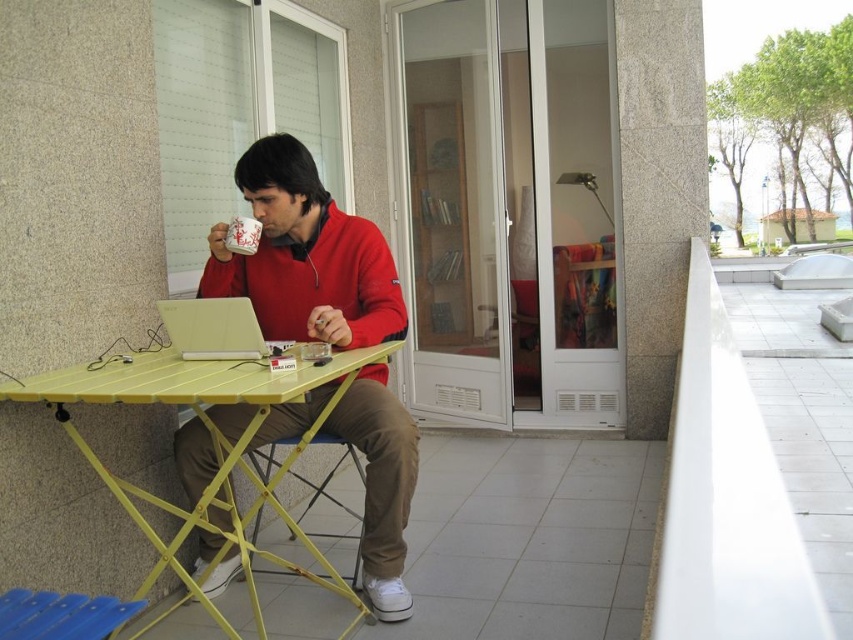
Is yellow plastic table at center bigger than white plastic laptop at center?

Yes.

Between yellow plastic table at center and white plastic laptop at center, which one is positioned higher?

white plastic laptop at center is above.

Find the location of a particular element. yellow plastic table at center is located at coordinates (213, 444).

I want to click on yellow plastic table at center, so click(213, 444).

Which is above, matte red sweater at center or white plastic laptop at center?

white plastic laptop at center

Which is more to the left, matte red sweater at center or white plastic laptop at center?

white plastic laptop at center is more to the left.

Where is `matte red sweater at center`? Image resolution: width=853 pixels, height=640 pixels. matte red sweater at center is located at coordinates (305, 257).

Can you confirm if matte red sweater at center is wider than yellow plastic table at center?

In fact, matte red sweater at center might be narrower than yellow plastic table at center.

Is point (399, 336) positioned behind point (222, 374)?

That is True.

Where is `matte red sweater at center`? matte red sweater at center is located at coordinates coord(305,257).